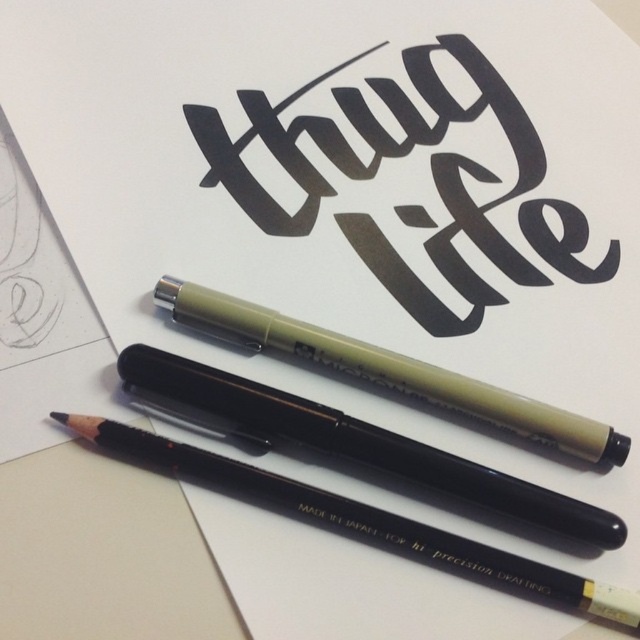
Between black matte pencil at center and matte olive pen at center, which one appears on the right side from the viewer's perspective?

Positioned to the right is matte olive pen at center.

Between black matte pencil at center and matte olive pen at center, which one appears on the left side from the viewer's perspective?

From the viewer's perspective, black matte pencil at center appears more on the left side.

What do you see at coordinates (353, 444) in the screenshot?
I see `black matte pencil at center` at bounding box center [353, 444].

Where is `black matte pencil at center`? This screenshot has height=640, width=640. black matte pencil at center is located at coordinates (x=353, y=444).

Where is `black calligraphy at center`? This screenshot has height=640, width=640. black calligraphy at center is located at coordinates (392, 160).

You are a GUI agent. You are given a task and a screenshot of the screen. Output one action in this format:
    pyautogui.click(x=<x>, y=<y>)
    Task: Click on the black calligraphy at center
    Image resolution: width=640 pixels, height=640 pixels.
    Given the screenshot: What is the action you would take?
    pyautogui.click(x=392, y=160)

Find the location of a particular element. This screenshot has width=640, height=640. black calligraphy at center is located at coordinates pos(392,160).

Does black calligraphy at center appear under black matte pencil at center?

Incorrect, black calligraphy at center is not positioned below black matte pencil at center.

Who is more distant from viewer, (400, 208) or (506, 480)?

The point (400, 208) is behind.

You are a GUI agent. You are given a task and a screenshot of the screen. Output one action in this format:
    pyautogui.click(x=<x>, y=<y>)
    Task: Click on the black calligraphy at center
    The height and width of the screenshot is (640, 640).
    Given the screenshot: What is the action you would take?
    pyautogui.click(x=392, y=160)